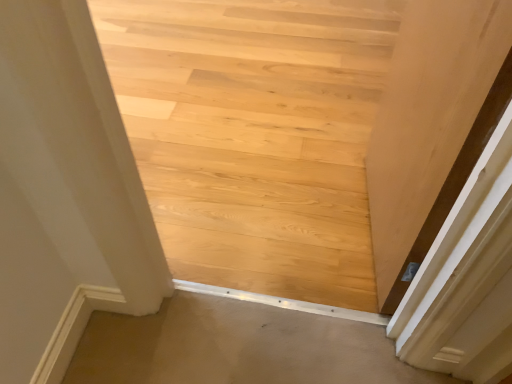
Image resolution: width=512 pixels, height=384 pixels. Identify the location of free spot to the left of matte wood door at right. (289, 218).